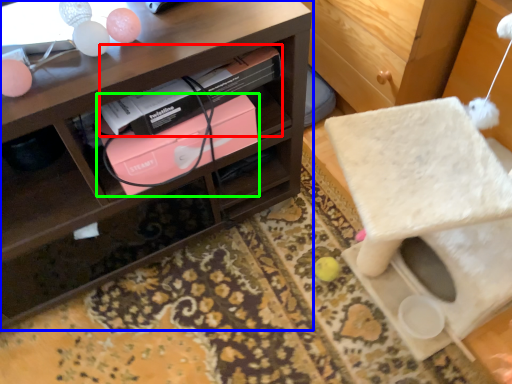
Question: Considering the real-world distances, which object is closest to book (highlighted by a red box)? shelf (highlighted by a blue box) or box (highlighted by a green box).

Choices:
 (A) shelf
 (B) box

Answer: (B)